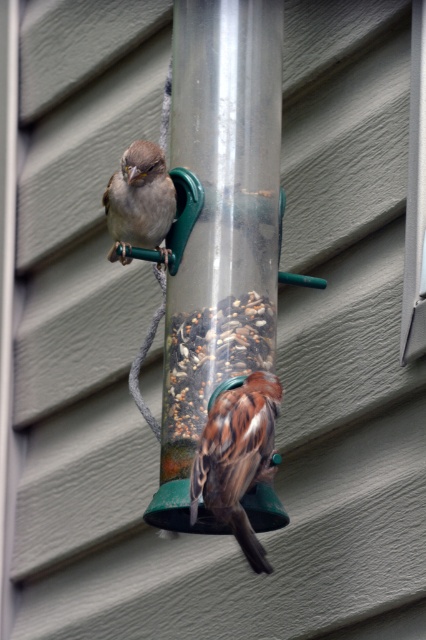
Question: Is brown speckled feathers at center smaller than matte brown sparrow at upper left?

Choices:
 (A) no
 (B) yes

Answer: (A)

Question: Can you confirm if brown speckled feathers at center is smaller than matte brown sparrow at upper left?

Choices:
 (A) yes
 (B) no

Answer: (B)

Question: Which point is farther from the camera taking this photo?

Choices:
 (A) (141, 216)
 (B) (261, 470)

Answer: (A)

Question: Which point is farther to the camera?

Choices:
 (A) (169, 208)
 (B) (235, 419)

Answer: (A)

Question: Is brown speckled feathers at center to the right of matte brown sparrow at upper left from the viewer's perspective?

Choices:
 (A) yes
 (B) no

Answer: (A)